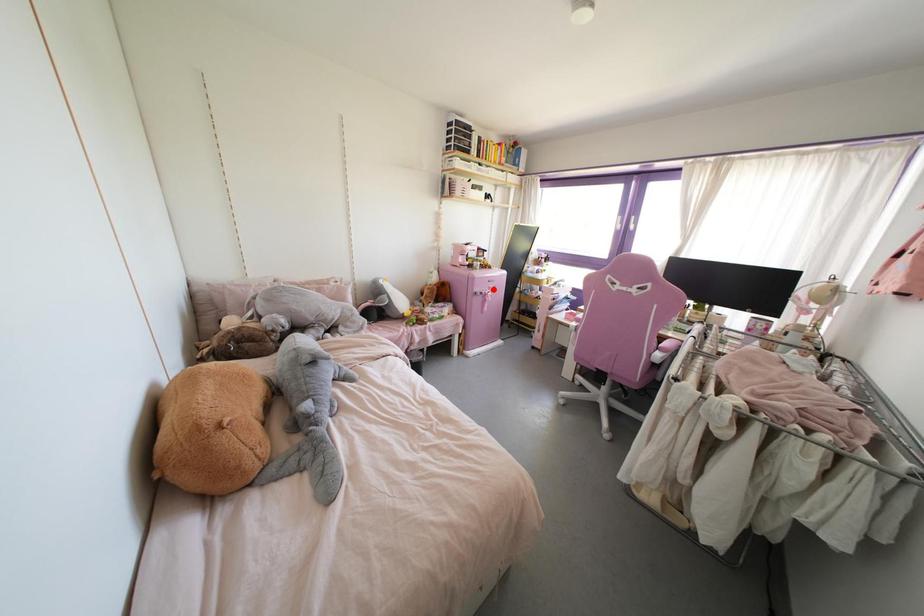
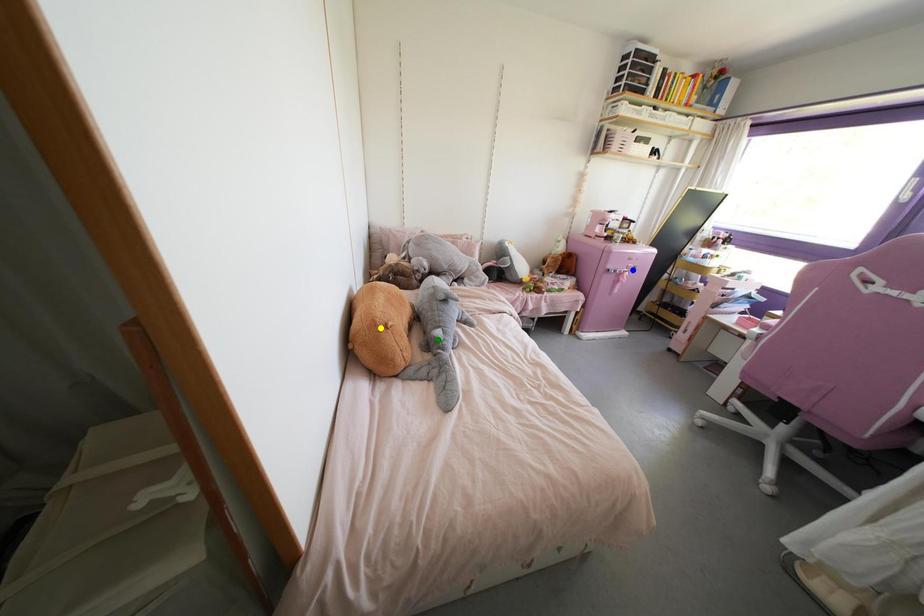
Question: I am providing you with two images of the same scene from different viewpoints. A red point is marked on the first image. You are given multiple points on the second image. Can you choose the point in image 2 that corresponds to the point in image 1?

Choices:
 (A) yellow point
 (B) green point
 (C) blue point

Answer: (C)